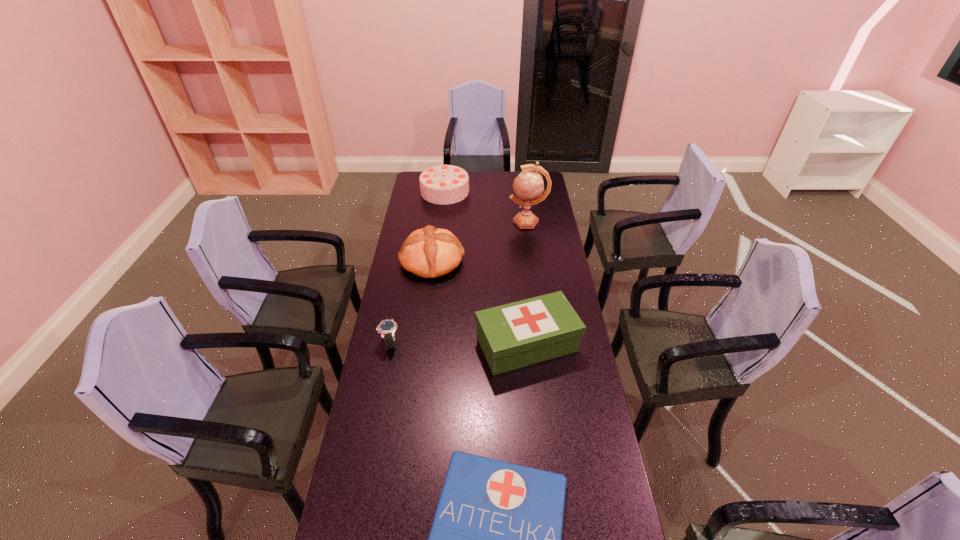
In order to click on free space located 0.270m on the front of the second tallest object in this screenshot , I will do `click(440, 235)`.

This screenshot has height=540, width=960. In order to click on free space located 0.260m on the right of the third farthest object in this screenshot , I will do `click(521, 261)`.

Where is `free location located 0.380m on the front of the farther first-aid kit`? The height and width of the screenshot is (540, 960). free location located 0.380m on the front of the farther first-aid kit is located at coordinates (541, 487).

Where is `vacant space located 0.300m on the back of the fifth tallest object`? vacant space located 0.300m on the back of the fifth tallest object is located at coordinates (402, 279).

This screenshot has height=540, width=960. Identify the location of object situated at the far edge. (444, 184).

At what (x,y) coordinates should I click in order to perform the action: click on birthday cake located in the left edge section of the desktop. Please return your answer as a coordinate pair (x, y). Looking at the image, I should click on (444, 184).

You are a GUI agent. You are given a task and a screenshot of the screen. Output one action in this format:
    pyautogui.click(x=<x>, y=<y>)
    Task: Click on the bread situated at the left edge
    
    Given the screenshot: What is the action you would take?
    pyautogui.click(x=430, y=252)

The height and width of the screenshot is (540, 960). Identify the location of watch present at the left edge. (387, 328).

Locate an element on the screen. The width and height of the screenshot is (960, 540). globe situated at the right edge is located at coordinates (528, 185).

This screenshot has width=960, height=540. Identify the location of the first-aid kit that is positioned at the right edge. (515, 335).